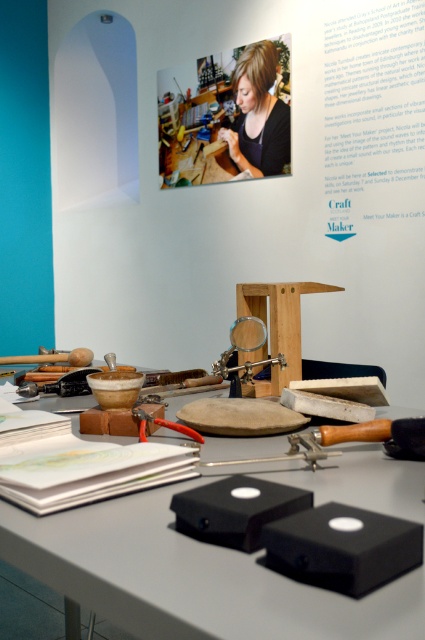
Question: Which of the following is the closest to the observer?

Choices:
 (A) black matte table at center
 (B) wooden stool at center
 (C) matte black shirt at upper center

Answer: (A)

Question: Does black matte table at center appear under matte black shirt at upper center?

Choices:
 (A) yes
 (B) no

Answer: (A)

Question: Which of the following is the closest to the observer?

Choices:
 (A) (255, 49)
 (B) (258, 301)

Answer: (B)

Question: Can you confirm if black matte table at center is positioned below wooden stool at center?

Choices:
 (A) no
 (B) yes

Answer: (B)

Question: Is matte black shirt at upper center above wooden stool at center?

Choices:
 (A) yes
 (B) no

Answer: (A)

Question: Which point is closer to the camera taking this photo?

Choices:
 (A) (314, 284)
 (B) (257, 112)

Answer: (A)